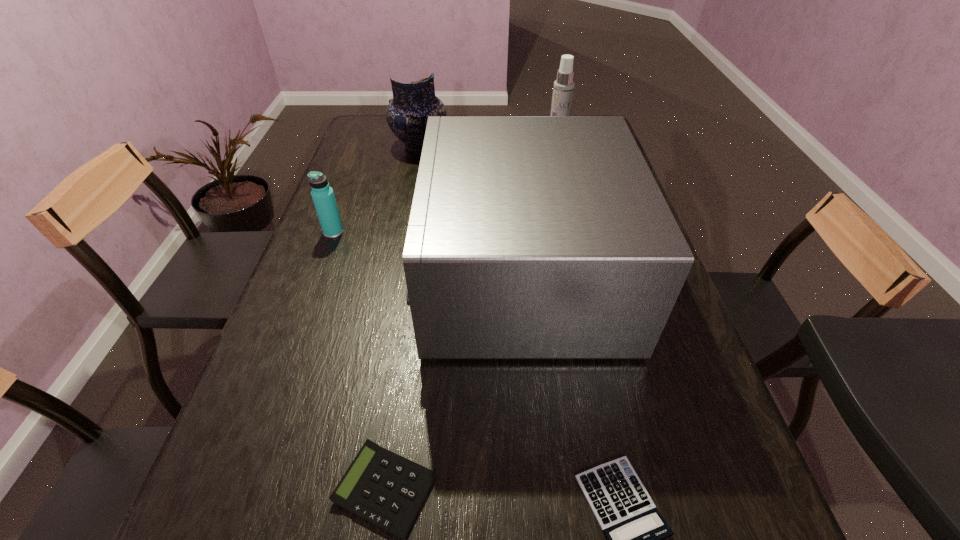
Locate an element on the screen. the second farthest object is located at coordinates (563, 88).

The image size is (960, 540). I want to click on the tallest object, so click(x=563, y=88).

Locate an element on the screen. This screenshot has height=540, width=960. the second tallest object is located at coordinates (530, 237).

The image size is (960, 540). I want to click on the farthest object, so click(x=407, y=113).

Identify the location of pottery. The height and width of the screenshot is (540, 960). pyautogui.click(x=407, y=113).

Where is `the third shortest object`? This screenshot has width=960, height=540. the third shortest object is located at coordinates (322, 194).

You are a GUI agent. You are given a task and a screenshot of the screen. Output one action in this format:
    pyautogui.click(x=<x>, y=<y>)
    Task: Click on the leftmost object
    
    Given the screenshot: What is the action you would take?
    pyautogui.click(x=322, y=194)

Where is `free space located 0.360m on the front of the tallest object`? This screenshot has width=960, height=540. free space located 0.360m on the front of the tallest object is located at coordinates (570, 245).

At what (x,y) coordinates should I click in order to perform the action: click on free space located with the door open on the fifth shortest object. Please return your answer as a coordinate pair (x, y). The width and height of the screenshot is (960, 540). Looking at the image, I should click on (336, 276).

Where is `vacant space located with the door open on the fifth shortest object`? The width and height of the screenshot is (960, 540). vacant space located with the door open on the fifth shortest object is located at coordinates (296, 276).